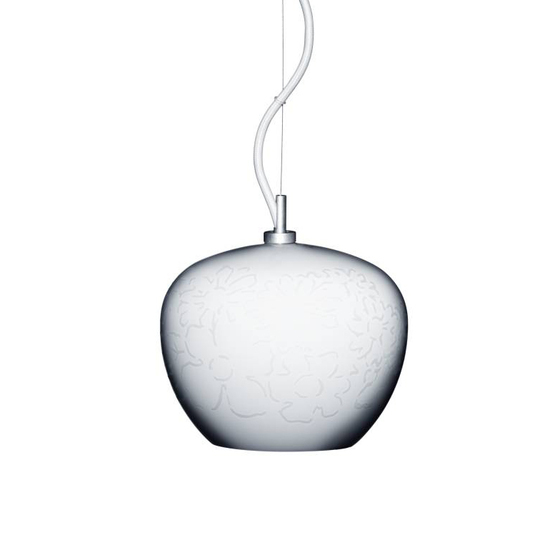
Where is `space left of lamp`? space left of lamp is located at coordinates (94, 332).